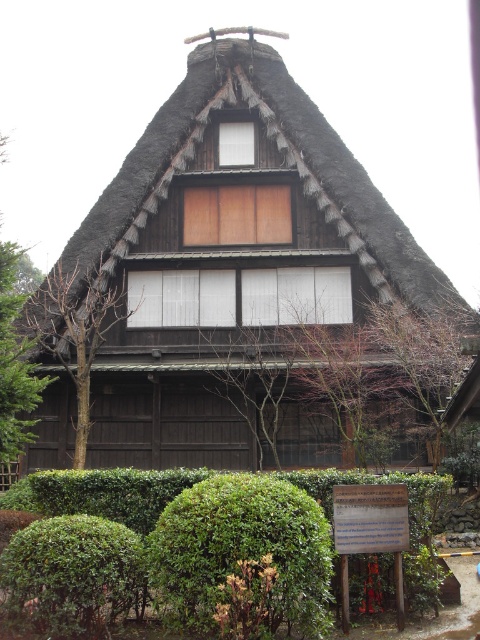
Between thatched straw roof at center and green leafy bush at lower left, which one is positioned lower?

green leafy bush at lower left is lower down.

How much distance is there between thatched straw roof at center and green leafy bush at lower left?

14.25 meters

The width and height of the screenshot is (480, 640). What are the coordinates of `thatched straw roof at center` in the screenshot? It's located at (288, 164).

Between green leafy bush at lower center and green leafy hedge at lower center, which one has more height?

green leafy hedge at lower center is taller.

Does green leafy bush at lower center have a lesser width compared to green leafy hedge at lower center?

Yes, green leafy bush at lower center is thinner than green leafy hedge at lower center.

Is point (217, 515) positioned before point (1, 538)?

Yes.

Where is `green leafy bush at lower center`? green leafy bush at lower center is located at coordinates (242, 557).

Can you confirm if green leafy bush at lower center is wider than green leafy bush at lower left?

Yes.

Who is taller, green leafy bush at lower center or green leafy bush at lower left?

green leafy bush at lower center is taller.

Between point (191, 600) and point (20, 544), which one is positioned behind?

Point (20, 544)

Where is `green leafy bush at lower center`? green leafy bush at lower center is located at coordinates (242, 557).